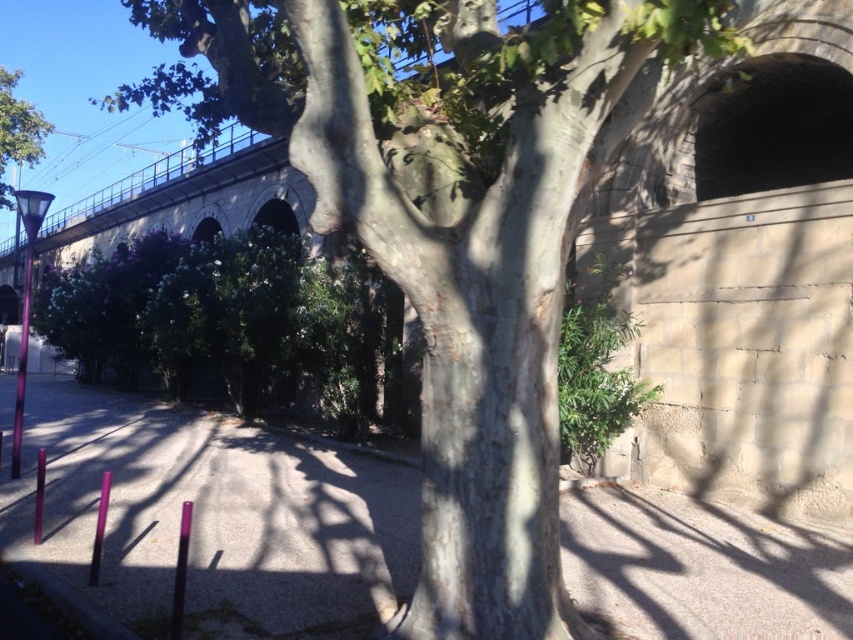
You are a pedestrian trying to find the entrance to the dark concrete tunnel at upper right. You see the green leafy tree at upper left in your view. Which direction should you move to locate the tunnel?

The dark concrete tunnel at upper right is in front of the green leafy tree at upper left, so you should move towards the direction where the green leafy tree at upper left is located to find the tunnel entrance.